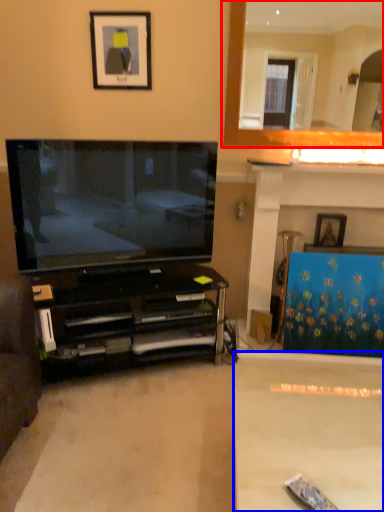
Question: Among these objects, which one is farthest to the camera, fireplace (highlighted by a red box) or plain (highlighted by a blue box)?

Choices:
 (A) fireplace
 (B) plain

Answer: (A)